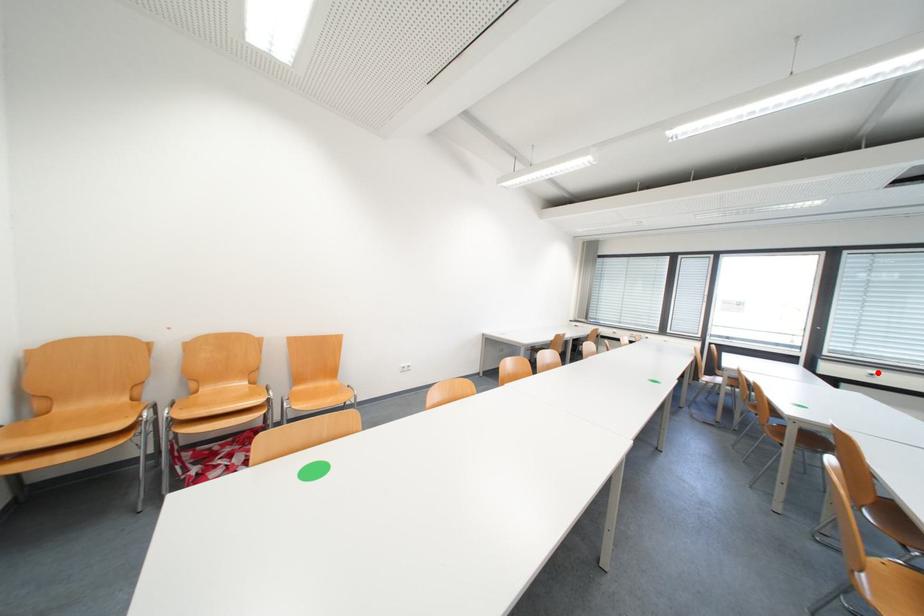
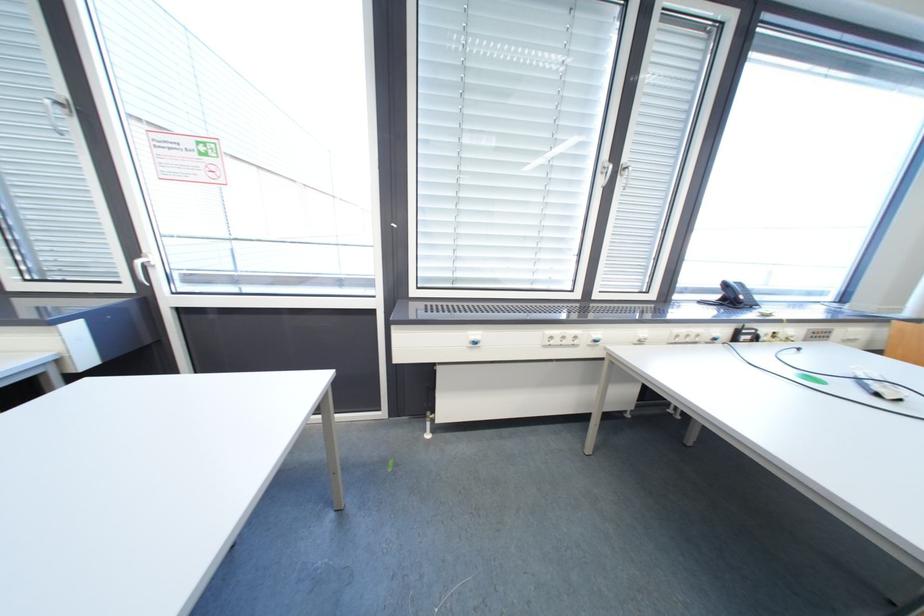
Question: I am providing you with two images of the same scene from different viewpoints. A red point is marked on the first image. At the location where the point appears in image 1, is it still visible in image 2?

Choices:
 (A) Yes
 (B) No

Answer: (A)